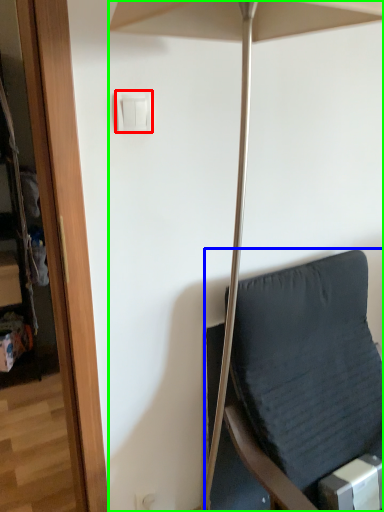
Question: Considering the real-world distances, which object is closest to light switch (highlighted by a red box)? furniture (highlighted by a blue box) or umbrella (highlighted by a green box).

Choices:
 (A) furniture
 (B) umbrella

Answer: (B)